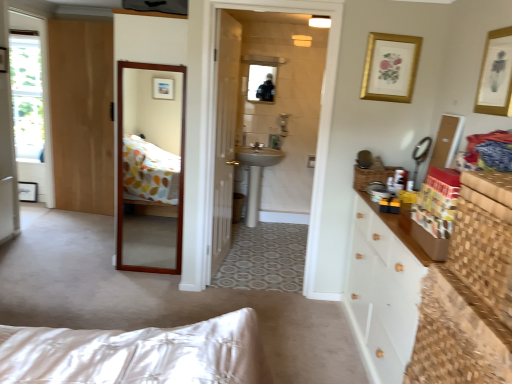
Measure the distance between translucent glass door at center, the second door in the left-to-right sequence, and camera.

The distance of translucent glass door at center, the second door in the left-to-right sequence, from camera is 9.21 feet.

Describe the element at coordinates (484, 239) in the screenshot. I see `woven wood chest at right, the 1th cabinetry in the front-to-back sequence` at that location.

The width and height of the screenshot is (512, 384). Describe the element at coordinates (27, 96) in the screenshot. I see `transparent glass window at upper left` at that location.

You are a GUI agent. You are given a task and a screenshot of the screen. Output one action in this format:
    pyautogui.click(x=<x>, y=<y>)
    Task: Click on the glossy glass mirror at upper center, acting as the second mirror starting from the right
    The height and width of the screenshot is (384, 512).
    Given the screenshot: What is the action you would take?
    pyautogui.click(x=261, y=83)

Describe the element at coordinates (256, 146) in the screenshot. Image resolution: width=512 pixels, height=384 pixels. I see `satin nickel faucet at center` at that location.

This screenshot has height=384, width=512. Identify the location of light brown wood door at left, the 1th door when ordered from back to front. (82, 114).

The height and width of the screenshot is (384, 512). I want to click on translucent glass door at center, the 1th door positioned from the front, so click(225, 136).

What's the angular difference between light brown wood door at left, the 2th door viewed from the front, and white satin bed at lower left's facing directions?

The angular difference between light brown wood door at left, the 2th door viewed from the front, and white satin bed at lower left is 99.4 degrees.

Considering the positions of objects light brown wood door at left, which is counted as the 2th door, starting from the right, and white satin bed at lower left in the image provided, who is in front, light brown wood door at left, which is counted as the 2th door, starting from the right, or white satin bed at lower left?

white satin bed at lower left is more forward.

Which of these two, light brown wood door at left, which is counted as the 2th door, starting from the right, or white satin bed at lower left, is thinner?

light brown wood door at left, which is counted as the 2th door, starting from the right, is thinner.

Is light brown wood door at left, the 2th door viewed from the front, oriented towards white satin bed at lower left?

No, light brown wood door at left, the 2th door viewed from the front, is not oriented towards white satin bed at lower left.

Is gold-framed artwork at upper right, the first picture frame viewed from the front, at the back of gold framed print at upper right, which is the first picture frame in back-to-front order?

gold framed print at upper right, which is the first picture frame in back-to-front order, does not have its back to gold-framed artwork at upper right, the first picture frame viewed from the front.

Between gold framed print at upper right, which is the first picture frame in back-to-front order, and gold-framed artwork at upper right, the first picture frame viewed from the front, which one has less height?

gold framed print at upper right, which is the first picture frame in back-to-front order, is shorter.

Considering the relative sizes of gold framed print at upper right, which is the 2th picture frame from front to back, and gold-framed artwork at upper right, the first picture frame viewed from the front, in the image provided, is gold framed print at upper right, which is the 2th picture frame from front to back, smaller than gold-framed artwork at upper right, the first picture frame viewed from the front,?

Yes.

Are gold framed print at upper right, which is the first picture frame in back-to-front order, and gold-framed artwork at upper right, the 1th picture frame from the right, making contact?

No, gold framed print at upper right, which is the first picture frame in back-to-front order, is not with gold-framed artwork at upper right, the 1th picture frame from the right.

Does gold framed print at upper right, which appears as the first picture frame when viewed from the left, have a greater width compared to woven wood chest at right, the second cabinetry when ordered from back to front?

Incorrect, the width of gold framed print at upper right, which appears as the first picture frame when viewed from the left, does not surpass that of woven wood chest at right, the second cabinetry when ordered from back to front.

Consider the image. Is gold framed print at upper right, positioned as the 2th picture frame in right-to-left order, aimed at woven wood chest at right, the 1th cabinetry in the front-to-back sequence?

Yes, gold framed print at upper right, positioned as the 2th picture frame in right-to-left order, is aimed at woven wood chest at right, the 1th cabinetry in the front-to-back sequence.

From a real-world perspective, which object rests below the other?

From a 3D spatial view, woven wood chest at right, the 1th cabinetry in the front-to-back sequence, is below.

Which picture frame is the 1st one when counting from the right side of the woven wood chest at right, the second cabinetry when ordered from back to front? Please provide its 2D coordinates.

[(390, 67)]

Is white satin bed at lower left aimed at glossy glass mirror at upper center, the 2th mirror from the bottom?

No, white satin bed at lower left is not aimed at glossy glass mirror at upper center, the 2th mirror from the bottom.

From the picture: From the image's perspective, does white satin bed at lower left appear higher than glossy glass mirror at upper center, marked as the 1th mirror in a top-to-bottom arrangement?

No, from the image's perspective, white satin bed at lower left is not above glossy glass mirror at upper center, marked as the 1th mirror in a top-to-bottom arrangement.

From a real-world perspective, does white satin bed at lower left stand above glossy glass mirror at upper center, acting as the second mirror starting from the right?

No, from a real-world perspective, white satin bed at lower left is not above glossy glass mirror at upper center, acting as the second mirror starting from the right.

Considering the sizes of white satin bed at lower left and glossy glass mirror at upper center, acting as the first mirror starting from the back, in the image, is white satin bed at lower left taller or shorter than glossy glass mirror at upper center, acting as the first mirror starting from the back,?

In the image, white satin bed at lower left appears to be shorter than glossy glass mirror at upper center, acting as the first mirror starting from the back.

Does translucent glass door at center, the second door in the left-to-right sequence, have a smaller size compared to glossy glass mirror at upper center, the 2th mirror from the bottom?

Incorrect, translucent glass door at center, the second door in the left-to-right sequence, is not smaller in size than glossy glass mirror at upper center, the 2th mirror from the bottom.

Is translucent glass door at center, the first door viewed from the right, positioned far away from glossy glass mirror at upper center, positioned as the second mirror in front-to-back order?

Absolutely, translucent glass door at center, the first door viewed from the right, is distant from glossy glass mirror at upper center, positioned as the second mirror in front-to-back order.

Where is `mirror behind the translucent glass door at center, the second door when ordered from back to front`? mirror behind the translucent glass door at center, the second door when ordered from back to front is located at coordinates (261, 83).

Considering the points (226, 83) and (252, 84), which point is behind, point (226, 83) or point (252, 84)?

Point (252, 84)

How different are the orientations of light brown wood door at left, placed as the first door when sorted from left to right, and wooden mirror at center in degrees?

light brown wood door at left, placed as the first door when sorted from left to right, and wooden mirror at center are facing 9.49 degrees away from each other.

Is light brown wood door at left, the 1th door when ordered from back to front, completely or partially outside of wooden mirror at center?

Absolutely, light brown wood door at left, the 1th door when ordered from back to front, is external to wooden mirror at center.

From a real-world perspective, is light brown wood door at left, the 2th door viewed from the front, beneath wooden mirror at center?

No, from a real-world perspective, light brown wood door at left, the 2th door viewed from the front, is not beneath wooden mirror at center.

Choose the correct answer: Is wooden drawer at center-right inside glossy glass mirror at upper center, acting as the first mirror starting from the back, or outside it?

wooden drawer at center-right lies outside glossy glass mirror at upper center, acting as the first mirror starting from the back.

This screenshot has height=384, width=512. In order to click on mirror behind the wooden drawer at center-right in this screenshot , I will do `click(261, 83)`.

Is wooden drawer at center-right to the left of glossy glass mirror at upper center, marked as the 1th mirror in a top-to-bottom arrangement, from the viewer's perspective?

No.

Identify the location of the 2nd door behind the white satin bed at lower left, counting from the anchor's position. Image resolution: width=512 pixels, height=384 pixels. (82, 114).

Identify the location of picture frame lying on the left of gold-framed artwork at upper right, the 2th picture frame positioned from the back. (390, 67).

Based on their spatial positions, is glossy glass mirror at upper center, the 1th mirror viewed from the left, or woven wood chest at right, the second cabinetry when ordered from back to front, closer to transparent glass window at upper left?

glossy glass mirror at upper center, the 1th mirror viewed from the left.

Which object lies further to the anchor point metallic silver mirror at upper right, the first mirror ordered from the bottom, translucent glass door at center, the second door in the left-to-right sequence, or satin nickel faucet at center?

satin nickel faucet at center.

From the image, which object appears to be farther from glossy glass mirror at upper center, acting as the first mirror starting from the back, gold framed print at upper right, which appears as the first picture frame when viewed from the left, or white ceramic sink at center?

gold framed print at upper right, which appears as the first picture frame when viewed from the left, is further to glossy glass mirror at upper center, acting as the first mirror starting from the back.

Considering their positions, is woven wood chest at right, the second cabinetry when ordered from back to front, positioned further to wooden mirror at center than metallic silver mirror at upper right, which is the first mirror in right-to-left order?

Based on the image, metallic silver mirror at upper right, which is the first mirror in right-to-left order, appears to be further to wooden mirror at center.

Which object lies nearer to the anchor point satin nickel faucet at center, white satin bed at lower left or translucent glass door at center, the 1th door positioned from the front?

Among the two, translucent glass door at center, the 1th door positioned from the front, is located nearer to satin nickel faucet at center.

When comparing their distances from white wood cabinet at right, placed as the first cabinetry when sorted from back to front, does transparent glass window at upper left or gold framed print at upper right, which is the 2th picture frame from front to back, seem closer?

The object closer to white wood cabinet at right, placed as the first cabinetry when sorted from back to front, is gold framed print at upper right, which is the 2th picture frame from front to back.

Looking at this image, estimate the real-world distances between objects in this image. Which object is further from transparent glass window at upper left, light brown wood door at left, the 2th door viewed from the front, or metallic silver mirror at upper right, which is the first mirror in right-to-left order?

metallic silver mirror at upper right, which is the first mirror in right-to-left order, lies further to transparent glass window at upper left than the other object.

When comparing their distances from white satin bed at lower left, does woven wood chest at right, the second cabinetry when ordered from back to front, or wooden drawer at center-right seem further?

wooden drawer at center-right is further to white satin bed at lower left.

In order to click on screen door located between white wood cabinet at right, placed as the first cabinetry when sorted from back to front, and glossy glass mirror at upper center, acting as the second mirror starting from the right, in the depth direction in this screenshot , I will do `click(150, 166)`.

Find the location of a particular element. This screenshot has width=512, height=384. cabinetry between white satin bed at lower left and white wood cabinet at right, placed as the first cabinetry when sorted from back to front, in the horizontal direction is located at coordinates (484, 239).

The image size is (512, 384). What are the coordinates of `screen door between woven wood chest at right, the second cabinetry when ordered from back to front, and transparent glass window at upper left in the front-back direction` in the screenshot? It's located at (150, 166).

Identify the location of screen door between white wood cabinet at right, the 2th cabinetry in the front-to-back sequence, and satin nickel faucet at center, along the z-axis. (150, 166).